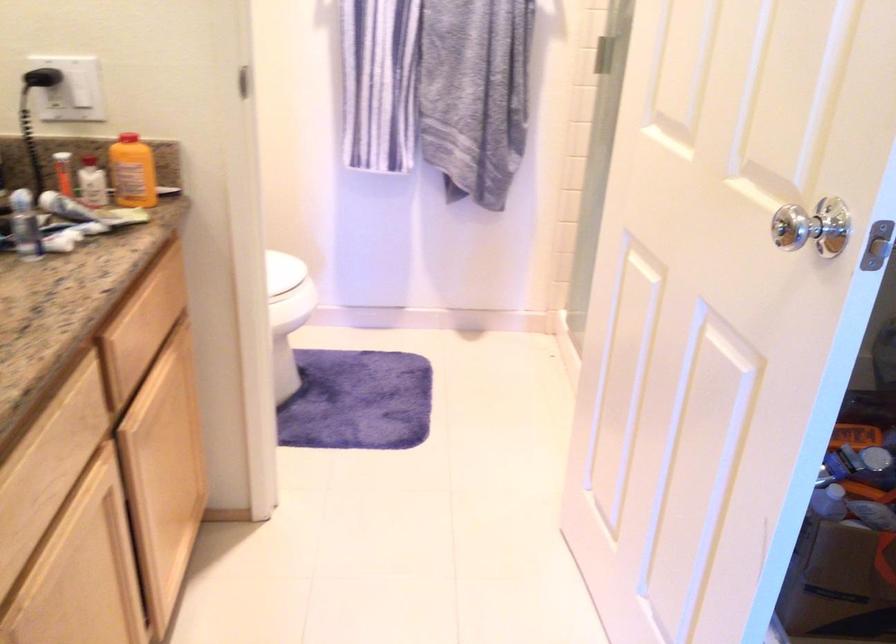
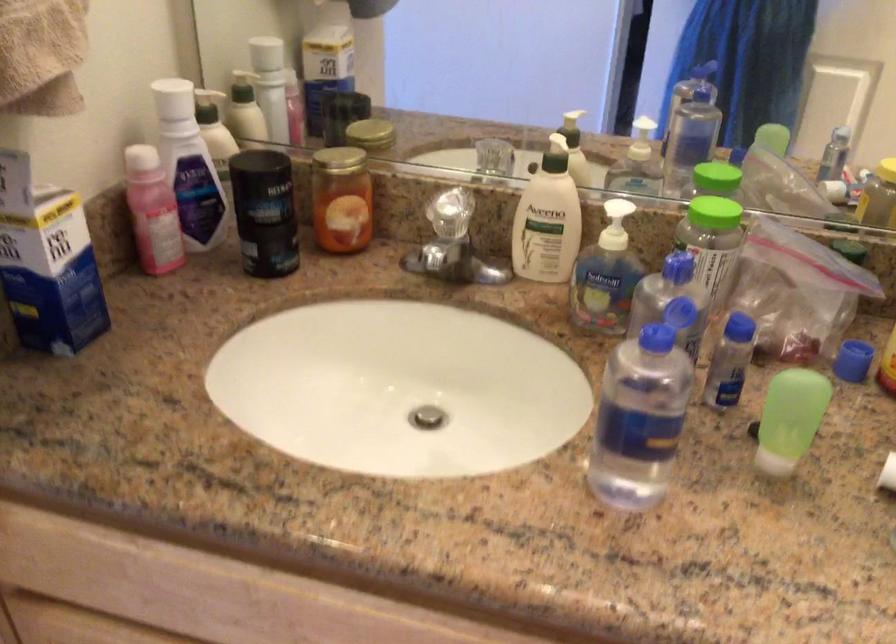
First-person continuous shooting, in which direction is the camera rotating?

The camera rotated toward left-down.